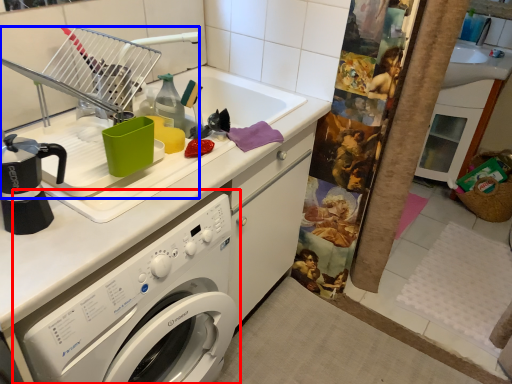
Question: Which point is further to the camera, washing machine (highlighted by a red box) or appliance (highlighted by a blue box)?

Choices:
 (A) washing machine
 (B) appliance

Answer: (B)